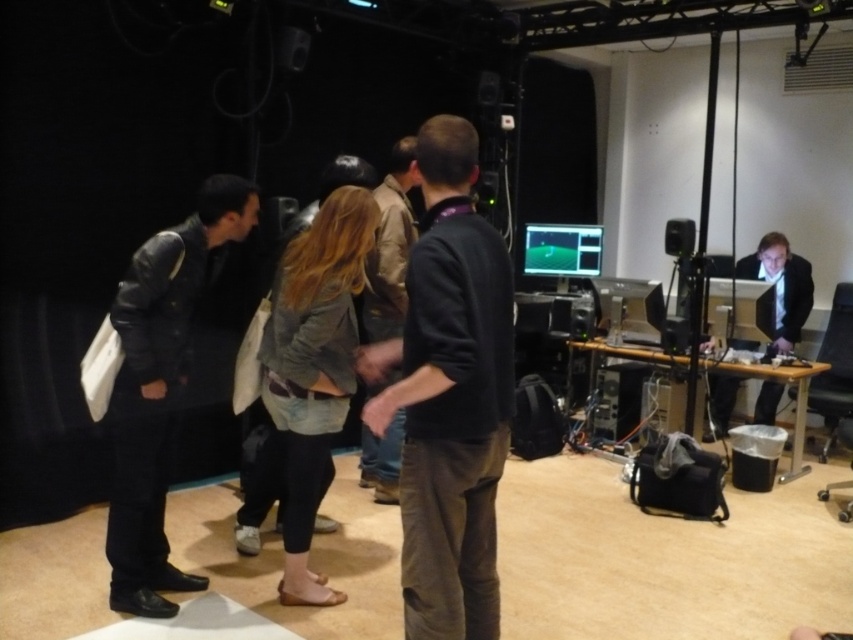
Question: Can you confirm if dark gray sweater at center is positioned above denim jacket at center?

Choices:
 (A) yes
 (B) no

Answer: (A)

Question: Which of these objects is positioned closest to the matte black suit at right?

Choices:
 (A) brown leather jacket at center
 (B) denim jacket at center
 (C) dark gray sweater at center

Answer: (A)

Question: Is dark gray sweater at center closer to camera compared to brown leather jacket at center?

Choices:
 (A) yes
 (B) no

Answer: (A)

Question: Which object appears farthest from the camera in this image?

Choices:
 (A) brown leather jacket at center
 (B) leather jacket at left
 (C) dark gray sweater at center
 (D) denim jacket at center

Answer: (A)

Question: Which of these objects is positioned farthest from the matte black suit at right?

Choices:
 (A) denim jacket at center
 (B) brown leather jacket at center

Answer: (A)

Question: Can you confirm if denim jacket at center is thinner than matte black suit at right?

Choices:
 (A) no
 (B) yes

Answer: (B)